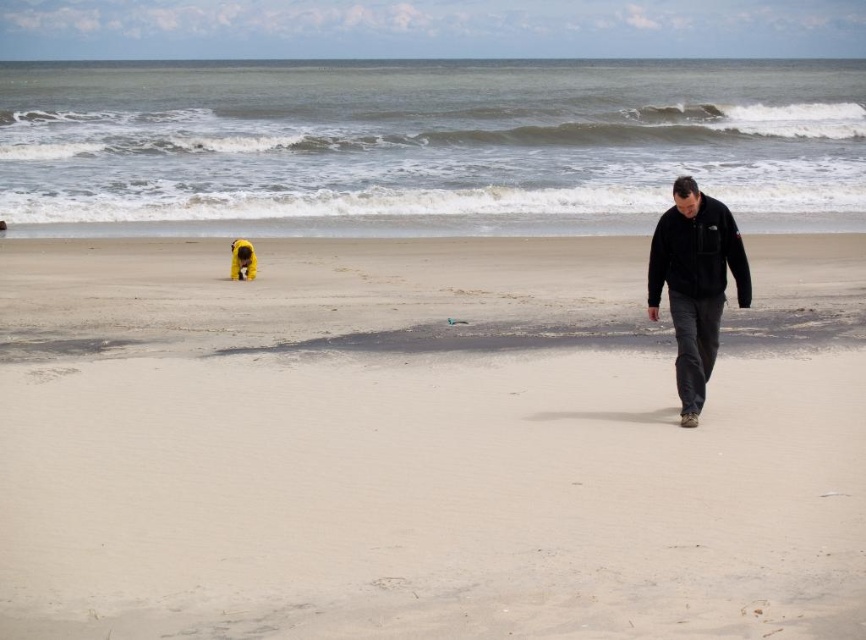
Question: Based on their relative distances, which object is farther from the yellow fur dog at left?

Choices:
 (A) black fleece jacket at right
 (B) smooth sand at center

Answer: (A)

Question: Does smooth sand at center lie in front of yellow fur dog at left?

Choices:
 (A) yes
 (B) no

Answer: (A)

Question: Can you confirm if smooth sand at center is wider than yellow fur dog at left?

Choices:
 (A) no
 (B) yes

Answer: (B)

Question: Among these points, which one is nearest to the camera?

Choices:
 (A) [242, 269]
 (B) [269, 348]

Answer: (B)

Question: Which point is closer to the camera taking this photo?

Choices:
 (A) (234, 257)
 (B) (341, 394)

Answer: (B)

Question: Does smooth sand at center have a larger size compared to black fleece jacket at right?

Choices:
 (A) yes
 (B) no

Answer: (A)